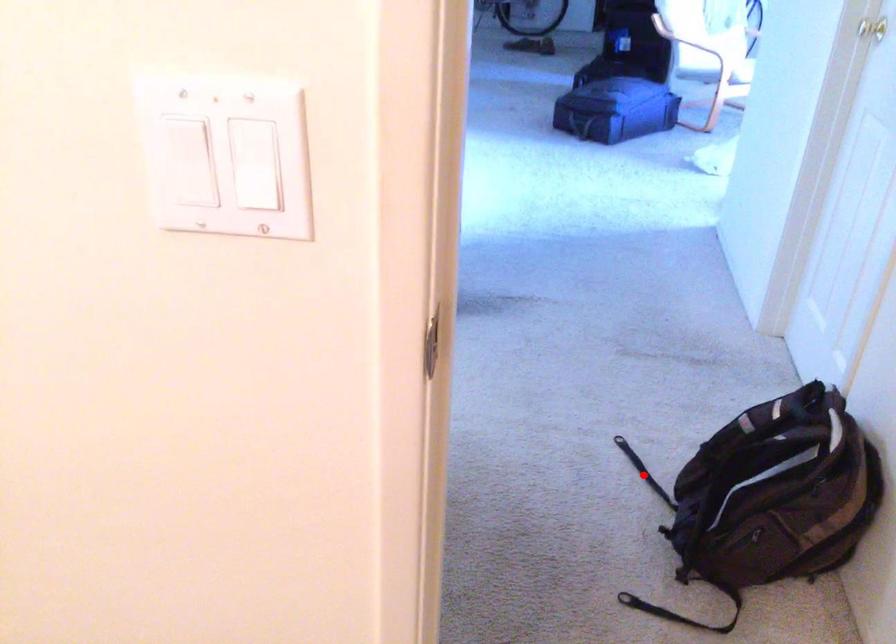
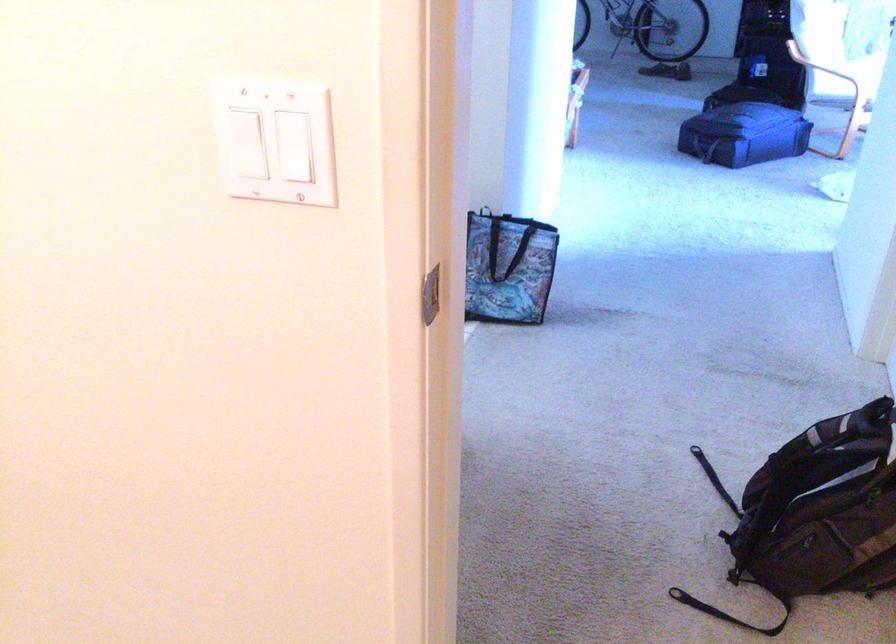
The point at the highlighted location is marked in the first image. Where is the corresponding point in the second image?

(713, 478)